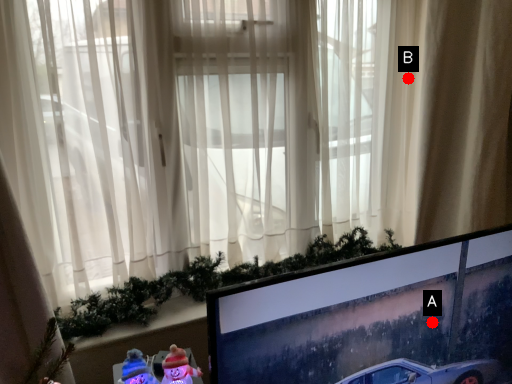
Question: Two points are circled on the image, labeled by A and B beside each circle. Which point is closer to the camera?

Choices:
 (A) A is closer
 (B) B is closer

Answer: (A)